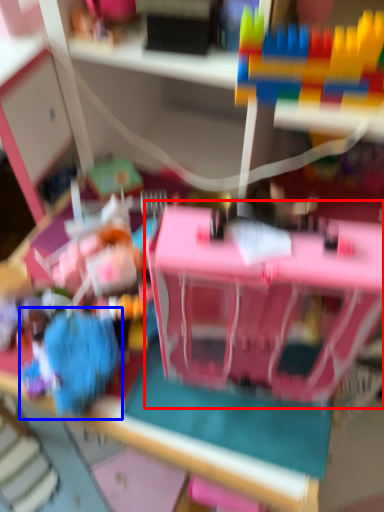
Question: Which of the following is the farthest to the observer, toy (highlighted by a red box) or toy (highlighted by a blue box)?

Choices:
 (A) toy
 (B) toy

Answer: (B)